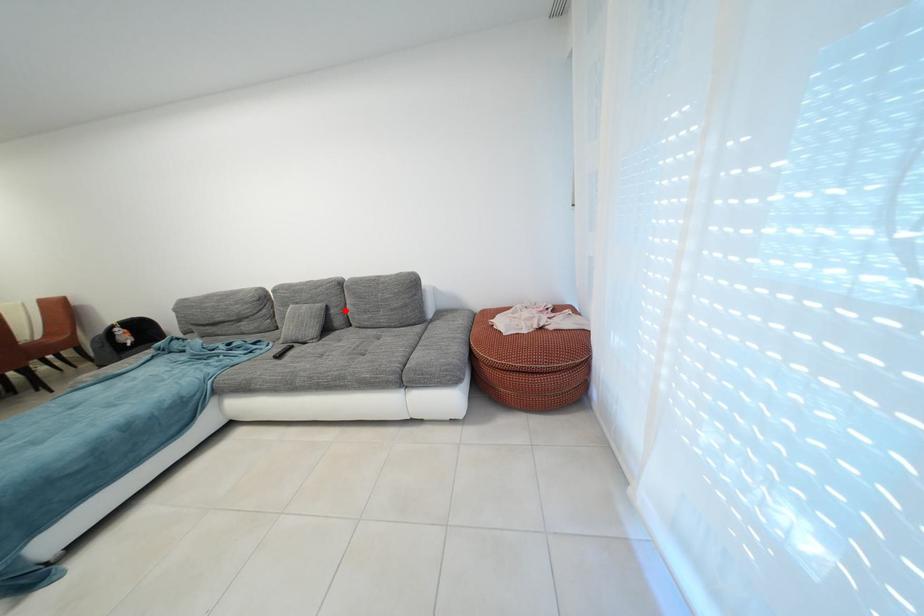
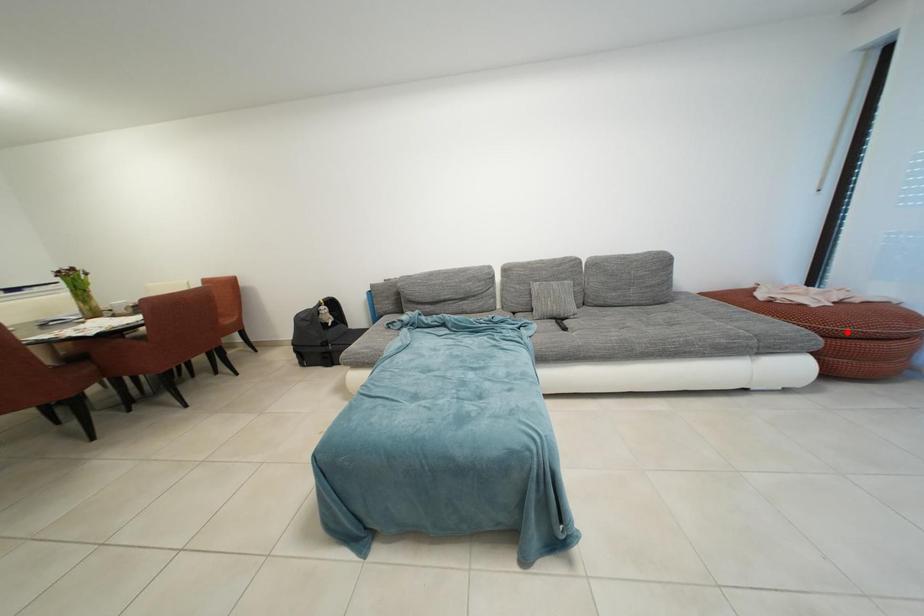
I am providing you with two images of the same scene from different viewpoints. A red point is marked on the first image and another point is marked on the second image. Is the marked point in image1 the same physical position as the marked point in image2?

No